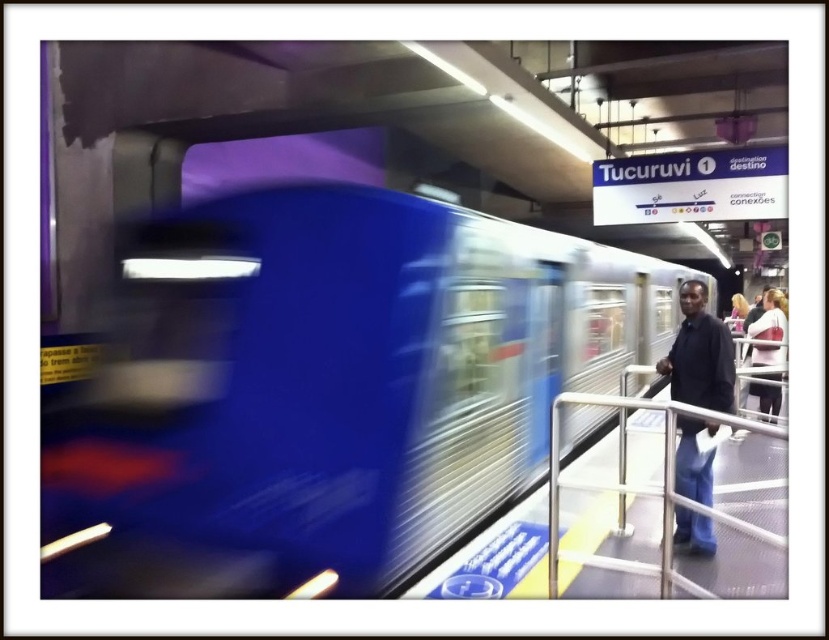
Based on the photo, you are standing at the train station platform and want to know where the metallic silver railing at right is located. Can you tell me its exact coordinates?

The metallic silver railing at right is located at coordinates point (642, 493).

You are standing on the platform at the Tucuruvi station and see the metallic blue train at center and the dark blue jeans at right. Which object appears narrower in the image?

The metallic blue train at center appears narrower than the dark blue jeans at right.